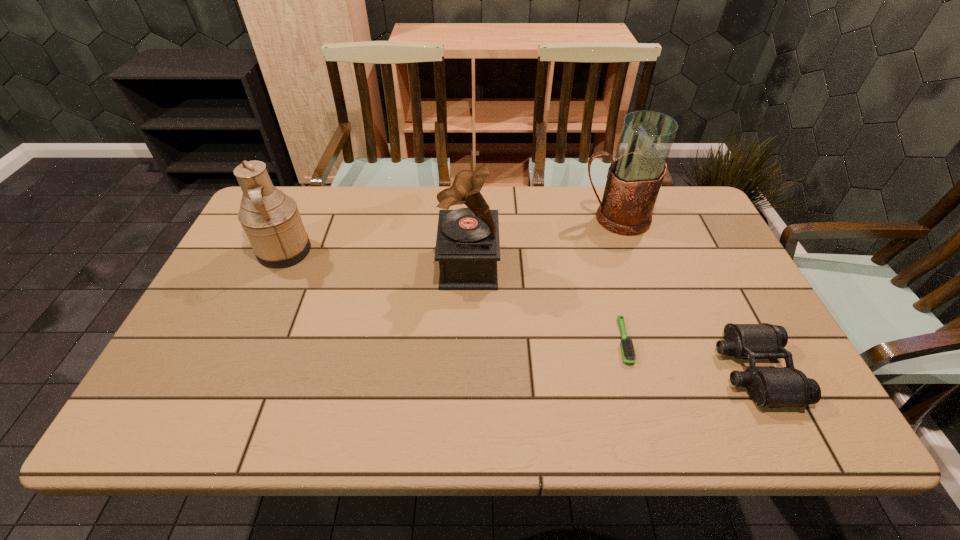
Where is `vacant area between the leftmost object and the hairbrush`? This screenshot has width=960, height=540. vacant area between the leftmost object and the hairbrush is located at coordinates (453, 296).

At what (x,y) coordinates should I click in order to perform the action: click on vacant area that lies between the phonograph_record and the right pitcher. Please return your answer as a coordinate pair (x, y). Looking at the image, I should click on (541, 241).

I want to click on free spot between the shortest object and the rightmost object, so click(689, 356).

Where is `vacant region between the shortest object and the fourth object from right to left`? This screenshot has width=960, height=540. vacant region between the shortest object and the fourth object from right to left is located at coordinates (546, 303).

Where is `vacant region between the second object from left to right and the rightmost object`? The image size is (960, 540). vacant region between the second object from left to right and the rightmost object is located at coordinates (612, 318).

Identify which object is located as the second nearest to the second object from left to right. Please provide its 2D coordinates. Your answer should be formatted as a tuple, i.e. [(x, y)], where the tuple contains the x and y coordinates of a point satisfying the conditions above.

[(628, 352)]

This screenshot has height=540, width=960. What are the coordinates of `object that is the nearest to the leftmost object` in the screenshot? It's located at (467, 247).

Where is `free region that satisfies the following two spatial constraints: 1. at the horn opening of the fourth object from right to left; 2. on the back side of the shortest object`? free region that satisfies the following two spatial constraints: 1. at the horn opening of the fourth object from right to left; 2. on the back side of the shortest object is located at coordinates (467, 341).